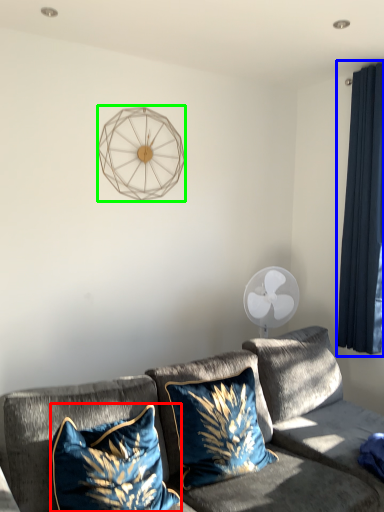
Question: Which object is the farthest from pillow (highlighted by a red box)? Choose among these: curtain (highlighted by a blue box) or lamp (highlighted by a green box).

Choices:
 (A) curtain
 (B) lamp

Answer: (A)